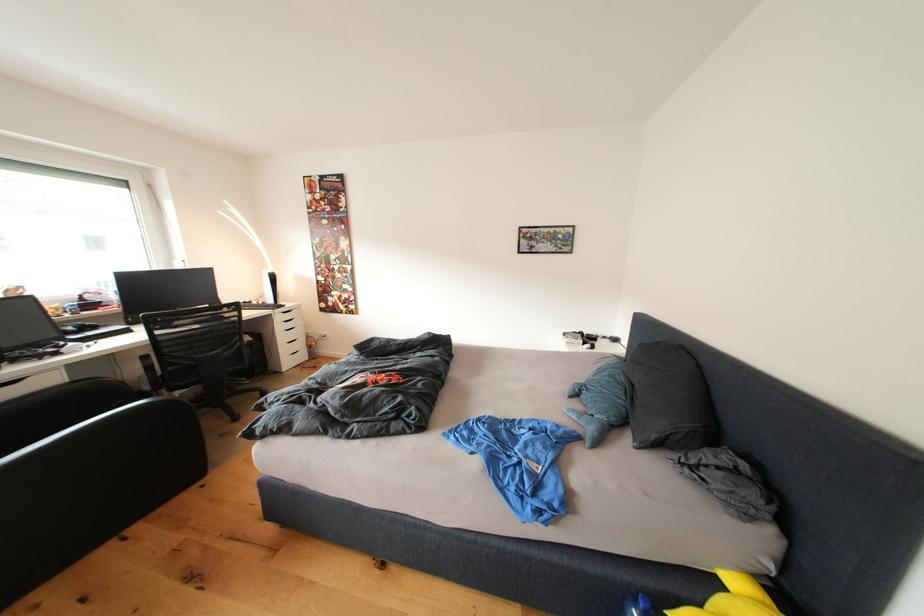
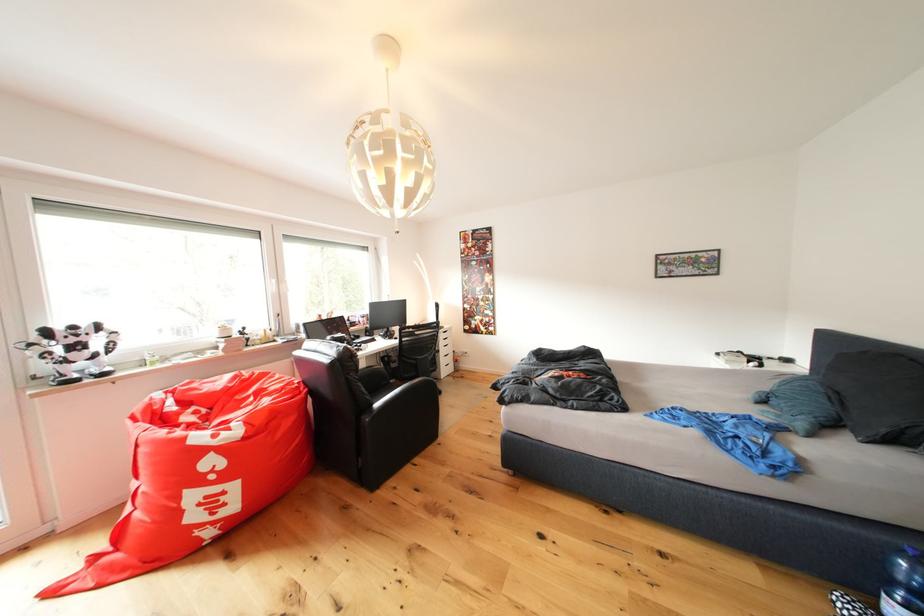
The images are taken continuously from a first-person perspective. In which direction are you moving?

The movement direction of the cameraman is left, backward.